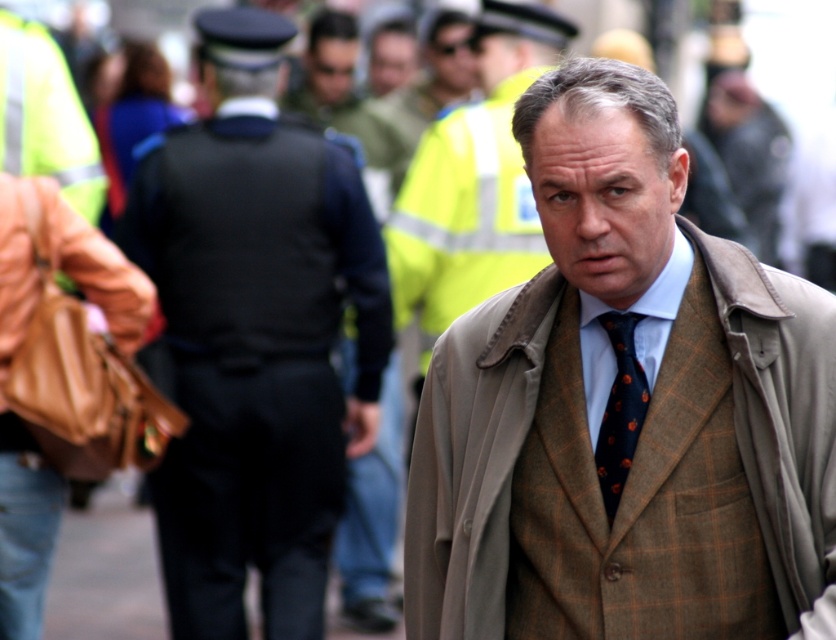
Is beige woolen trench coat at center further to the viewer compared to dark blue textured tie at center?

No, it is not.

Is beige woolen trench coat at center above dark blue textured tie at center?

Incorrect, beige woolen trench coat at center is not positioned above dark blue textured tie at center.

Describe the element at coordinates (472, 461) in the screenshot. The height and width of the screenshot is (640, 836). I see `beige woolen trench coat at center` at that location.

Locate an element on the screen. This screenshot has width=836, height=640. beige woolen trench coat at center is located at coordinates (472, 461).

Locate an element on the screen. dark blue uniform at center is located at coordinates (255, 337).

In the scene shown: Is the position of dark blue uniform at center more distant than that of dark blue textured tie at center?

Yes.

Is point (220, 296) in front of point (609, 481)?

No, it is behind (609, 481).

Locate an element on the screen. dark blue uniform at center is located at coordinates (255, 337).

Which is in front, point (209, 301) or point (757, 333)?

Positioned in front is point (757, 333).

Is point (314, 337) positioned after point (772, 323)?

That is True.

At what (x,y) coordinates should I click in order to perform the action: click on dark blue uniform at center. Please return your answer as a coordinate pair (x, y). Looking at the image, I should click on (255, 337).